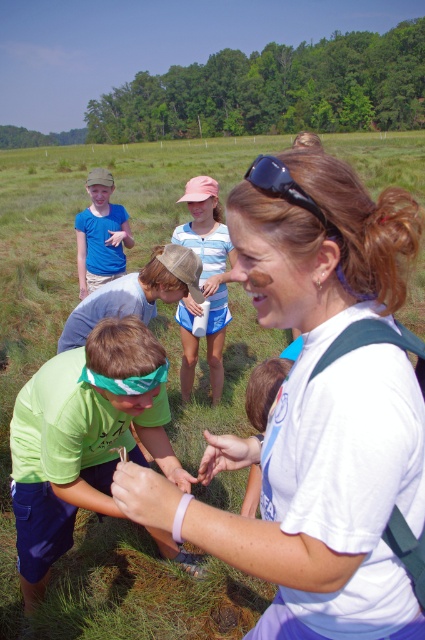
Question: Where is green fabric headband at lower left located in relation to green fabric shirt at center in the image?

Choices:
 (A) below
 (B) above

Answer: (A)

Question: Which point appears closest to the camera in this image?

Choices:
 (A) (280, 180)
 (B) (218, 262)
 (C) (108, 253)

Answer: (A)

Question: Among these objects, which one is nearest to the camera?

Choices:
 (A) pink fabric cap at upper center
 (B) green fabric headband at lower left
 (C) black rubber sunglasses at upper center
 (D) green fabric shirt at center

Answer: (C)

Question: Is green fabric headband at lower left positioned before pink fabric cap at upper center?

Choices:
 (A) yes
 (B) no

Answer: (A)

Question: Based on their relative distances, which object is farther from the matte blue shirt at upper left?

Choices:
 (A) pink fabric cap at upper center
 (B) green fabric headband at lower left
 (C) green fabric shirt at center

Answer: (C)

Question: Does green fabric headband at lower left have a larger size compared to pink fabric cap at upper center?

Choices:
 (A) no
 (B) yes

Answer: (A)